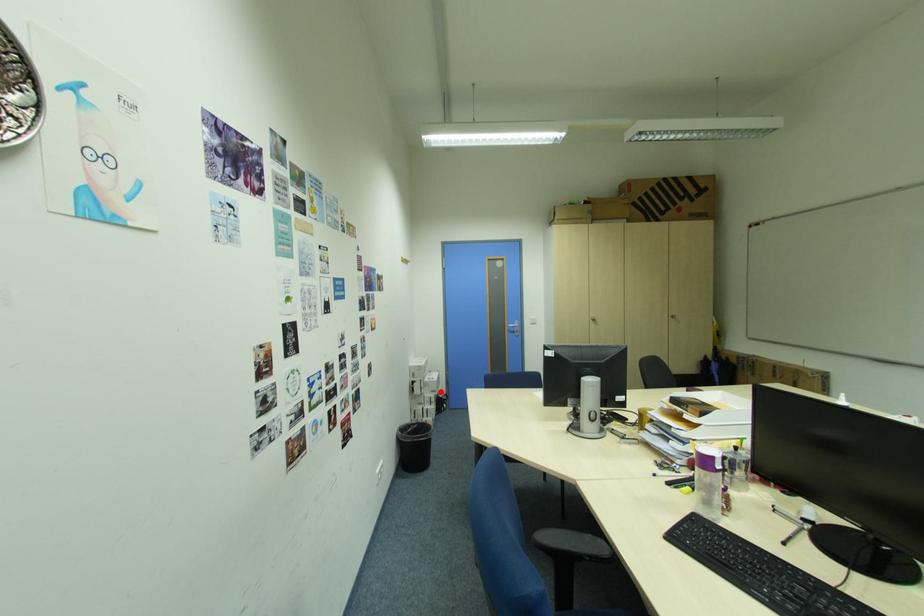
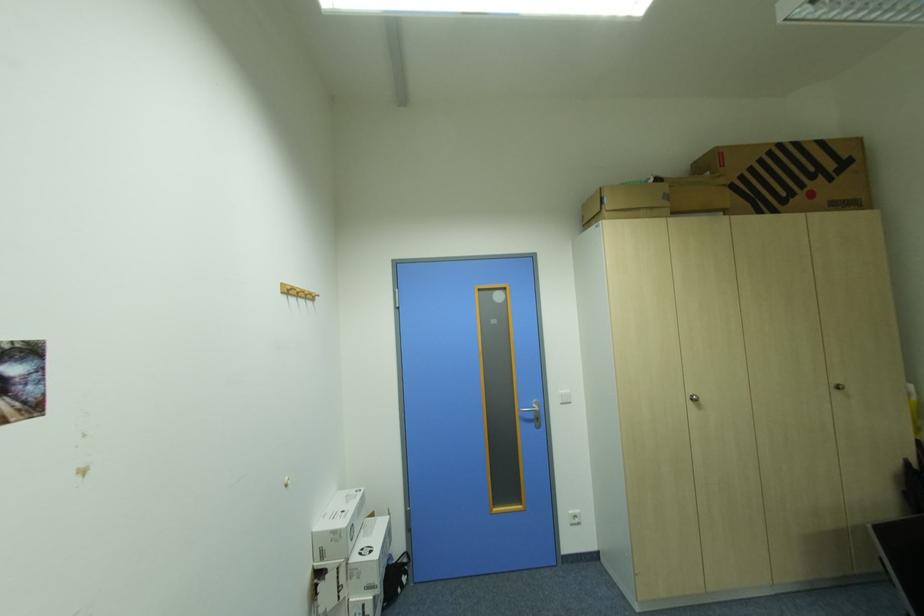
Find the pixel in the second image that matches the highlighted location in the first image.

(377, 590)